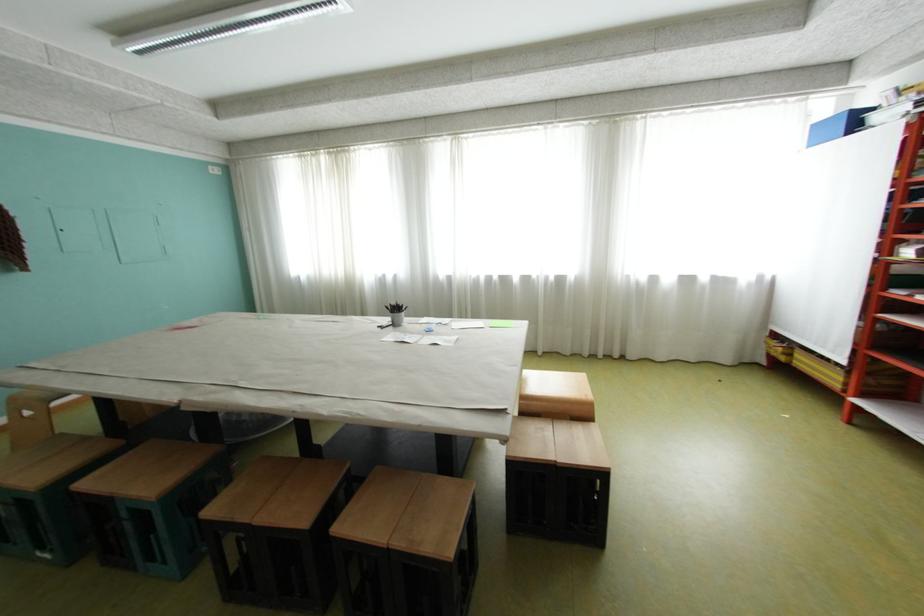
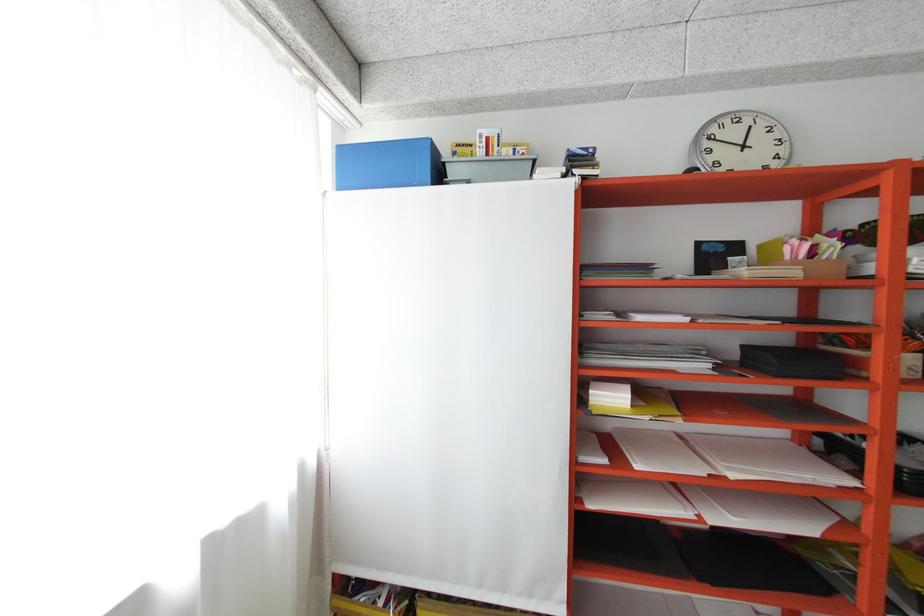
Where in the second image is the point corresponding to pixel 883 119 from the first image?

(460, 172)